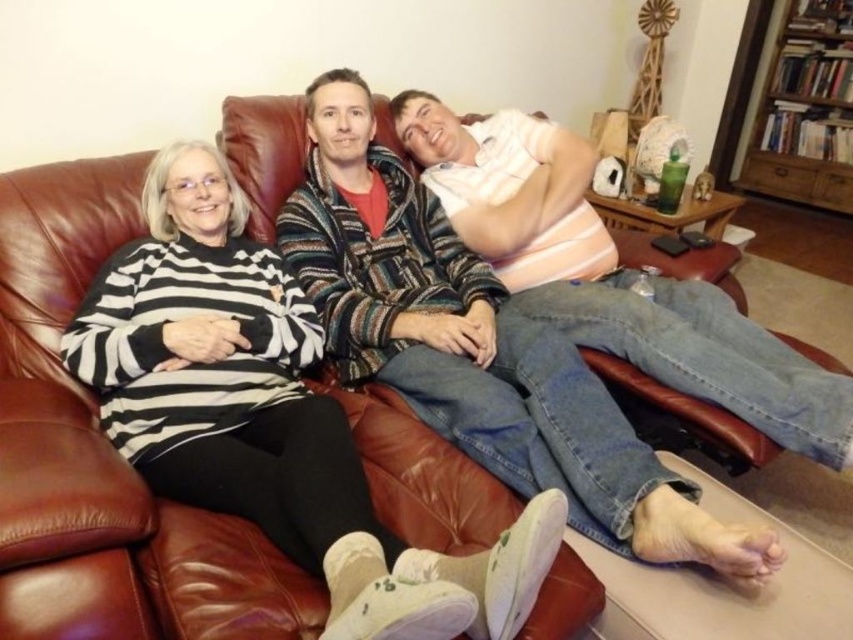
Does black and white striped sweater at left come behind striped sweater at center?

No.

Measure the distance between point (213, 472) and camera.

Point (213, 472) is 4.15 feet away from camera.

Where is `black and white striped sweater at left`? black and white striped sweater at left is located at coordinates (270, 417).